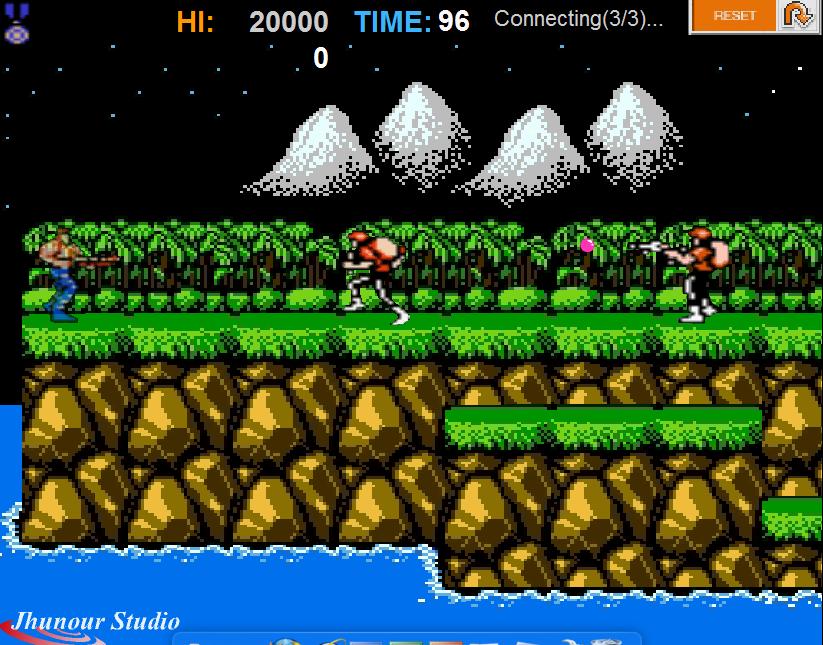
At what (x,y) coordinates should I click in order to perform the action: click on "studio". Please return your answer as a coordinate pair (x, y). The height and width of the screenshot is (645, 823). Looking at the image, I should click on (149, 630).